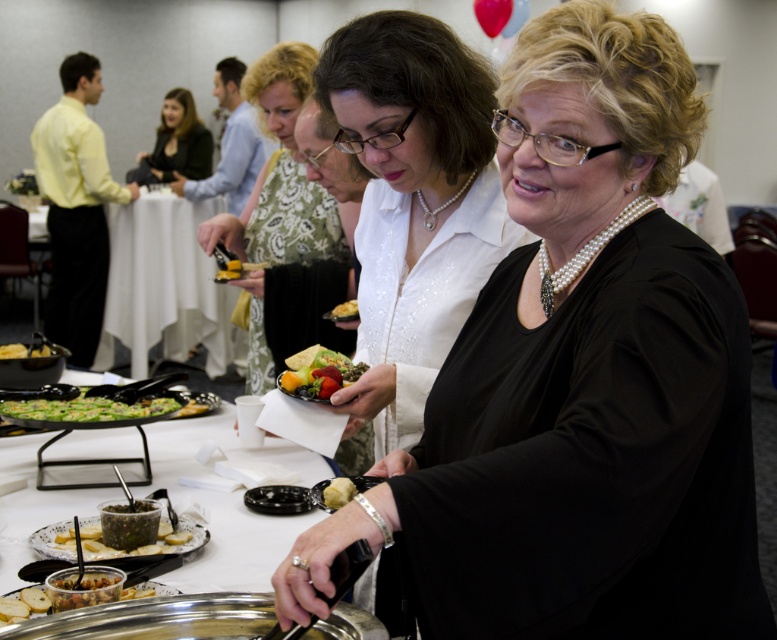
Can you confirm if matte black platter at lower left is positioned to the right of golden crisp bread at center?

Incorrect, matte black platter at lower left is not on the right side of golden crisp bread at center.

Can you confirm if matte black platter at lower left is wider than golden crisp bread at center?

Yes, matte black platter at lower left is wider than golden crisp bread at center.

Find the location of a particular element. The height and width of the screenshot is (640, 777). matte black platter at lower left is located at coordinates (53, 540).

In the scene shown: Which is below, green matte vegetable roll at lower left or smooth white plate at lower center?

smooth white plate at lower center

Does green matte vegetable roll at lower left appear over smooth white plate at lower center?

Indeed, green matte vegetable roll at lower left is positioned over smooth white plate at lower center.

Between point (30, 412) and point (312, 486), which one is positioned in front?

Point (312, 486)

In order to click on green matte vegetable roll at lower left in this screenshot , I will do `click(89, 406)`.

Does pearl necklace at center appear on the left side of black plastic tray at lower left?

Incorrect, pearl necklace at center is not on the left side of black plastic tray at lower left.

Does pearl necklace at center come behind black plastic tray at lower left?

No, pearl necklace at center is closer to the viewer.

Does point (559, 470) come closer to viewer compared to point (106, 333)?

Yes, point (559, 470) is in front of point (106, 333).

Where is `pearl necklace at center`? This screenshot has height=640, width=777. pearl necklace at center is located at coordinates (577, 384).